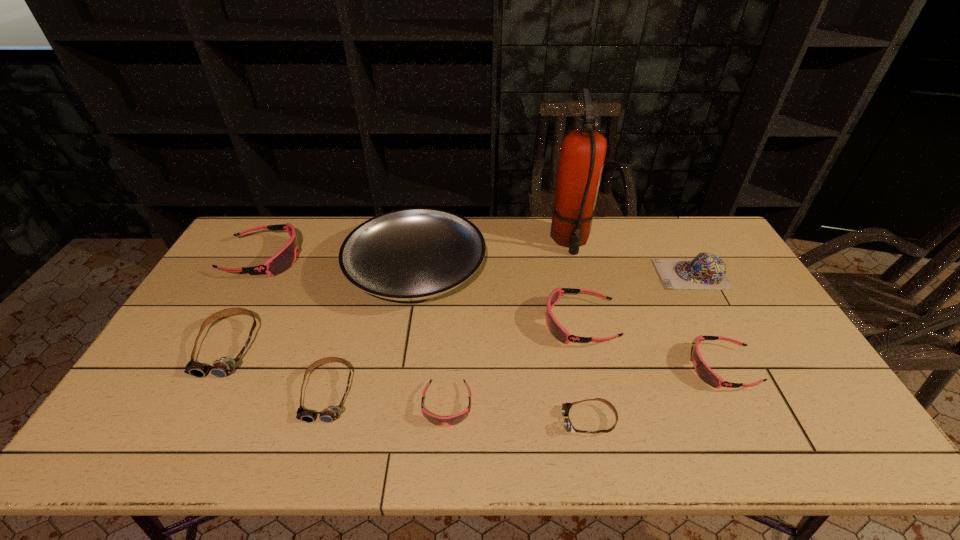
At what (x,y) coordinates should I click in order to perform the action: click on vacant region at the far left corner of the desktop. Please return your answer as a coordinate pair (x, y). Looking at the image, I should click on (x=261, y=224).

Where is `free space at the near left corner of the desktop`? The image size is (960, 540). free space at the near left corner of the desktop is located at coordinates (155, 444).

This screenshot has width=960, height=540. I want to click on empty space that is in between the rightmost brown goggles and the fourth goggles from left to right, so click(517, 413).

You are a GUI agent. You are given a task and a screenshot of the screen. Output one action in this format:
    pyautogui.click(x=<x>, y=<y>)
    Task: Click on the empty location between the cap and the tallest object
    This screenshot has height=540, width=960.
    Given the screenshot: What is the action you would take?
    pyautogui.click(x=631, y=258)

The image size is (960, 540). Find the location of `free point between the fourth goggles from left to right and the smallest brown goggles`. free point between the fourth goggles from left to right and the smallest brown goggles is located at coordinates tap(517, 413).

Where is `vacant point located between the third biggest pink goggles and the second biggest pink goggles`? This screenshot has height=540, width=960. vacant point located between the third biggest pink goggles and the second biggest pink goggles is located at coordinates click(x=651, y=345).

This screenshot has width=960, height=540. Identify the location of vacant point located between the leftmost brown goggles and the third pink goggles from right to left. (337, 376).

Identify the location of vacant area that lies between the tallest object and the second smallest brown goggles. This screenshot has width=960, height=540. (448, 316).

The image size is (960, 540). Find the location of `vacant space that's between the fire extinguisher and the second pink goggles from right to left`. vacant space that's between the fire extinguisher and the second pink goggles from right to left is located at coordinates click(575, 281).

At what (x,y) coordinates should I click in order to perform the action: click on object that is the fifth closest to the bedpan. Please return your answer as a coordinate pair (x, y). This screenshot has width=960, height=540. Looking at the image, I should click on (453, 420).